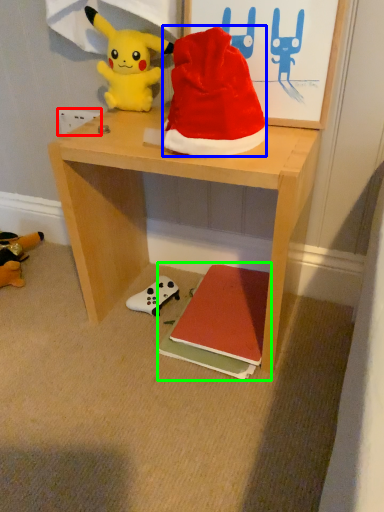
Question: Based on their relative distances, which object is nearer to power outlet (highlighted by a red box)? Choose from hat (highlighted by a blue box) and book (highlighted by a green box).

Choices:
 (A) hat
 (B) book

Answer: (A)